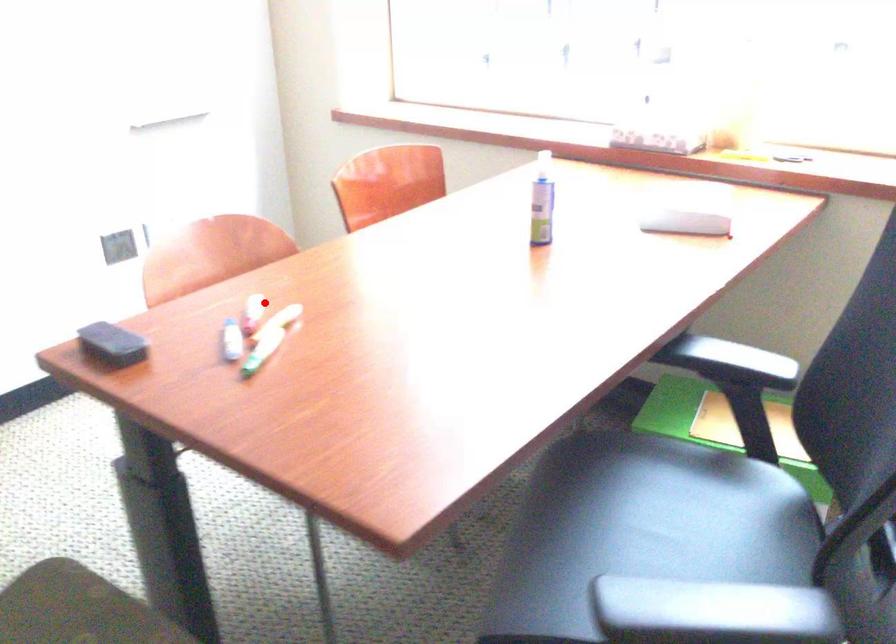
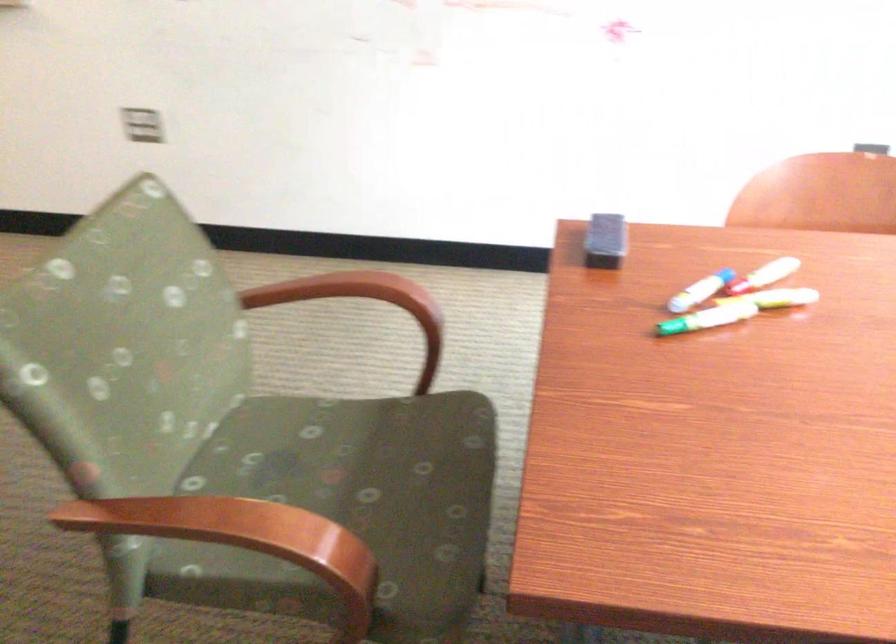
Question: A red point is marked in image1. In image2, is the corresponding 3D point closer to the camera or farther? Reply with the corresponding letter.

Choices:
 (A) The corresponding 3D point is closer.
 (B) The corresponding 3D point is farther.

Answer: (A)